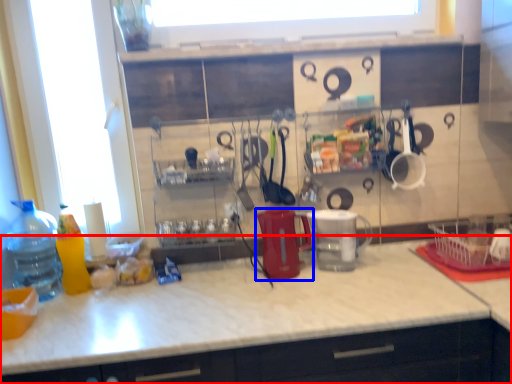
Question: Which object appears farthest to the camera in this image, countertop (highlighted by a red box) or appliance (highlighted by a blue box)?

Choices:
 (A) countertop
 (B) appliance

Answer: (B)